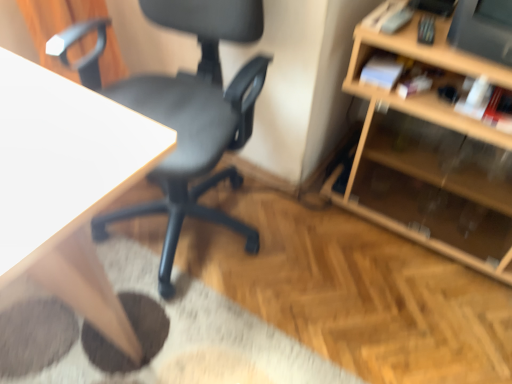
Image resolution: width=512 pixels, height=384 pixels. Find the location of `free space in front of wooden shelf at right`. free space in front of wooden shelf at right is located at coordinates (414, 306).